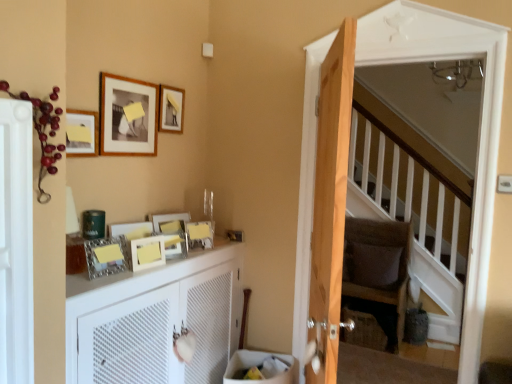
I want to click on free space in front of wooden photo frame at center, the 8th picture frame from the top, so click(x=132, y=273).